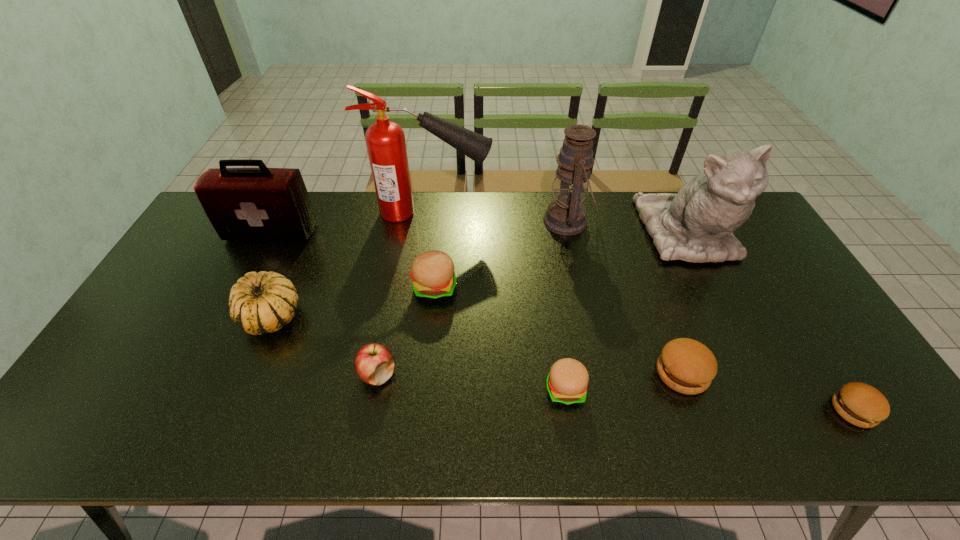
In the image, there is a desktop. Identify the location of vacant space at the near right corner. (906, 448).

Locate an element on the screen. This screenshot has height=540, width=960. free space between the second hamburger from left to right and the apple is located at coordinates (471, 382).

What are the coordinates of `free space between the oil lamp and the cat` in the screenshot? It's located at (627, 228).

Find the location of a particular element. The image size is (960, 540). vacant area that lies between the red fire extinguisher and the second hamburger from right to left is located at coordinates (556, 293).

This screenshot has width=960, height=540. I want to click on free spot between the smaller beige hamburger and the red fire extinguisher, so click(497, 301).

The image size is (960, 540). In order to click on unoccupied position between the shortest object and the bigger beige hamburger in this screenshot , I will do `click(644, 349)`.

Where is `vacant region between the oil lamp and the smaller beige hamburger`? vacant region between the oil lamp and the smaller beige hamburger is located at coordinates (566, 306).

This screenshot has width=960, height=540. What are the coordinates of `free point between the smaller beige hamburger and the apple` in the screenshot? It's located at (471, 382).

The width and height of the screenshot is (960, 540). Identify the location of empty space between the second hamburger from right to left and the third hamburger from right to left. (624, 381).

Locate which object ranks fifth in proximity to the oil lamp. Please provide its 2D coordinates. Your answer should be formatted as a tuple, i.e. [(x, y)], where the tuple contains the x and y coordinates of a point satisfying the conditions above.

[(567, 381)]